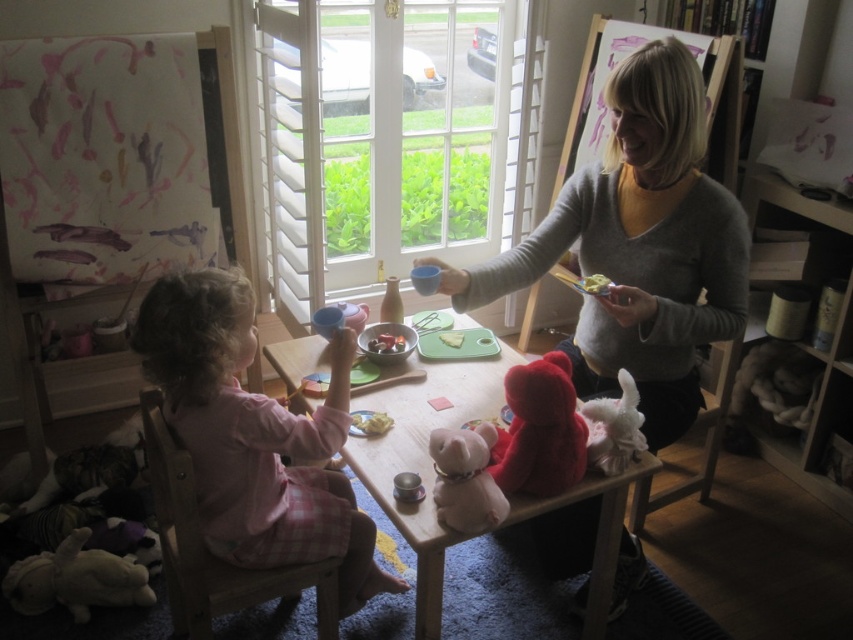
Question: Which of the following is the farthest from the observer?

Choices:
 (A) (599, 620)
 (B) (619, 376)
 (C) (374, 349)

Answer: (C)

Question: Is fluffy white stuffed animal at lower center to the left of smooth plastic spoon at center from the viewer's perspective?

Choices:
 (A) no
 (B) yes

Answer: (A)

Question: Is gray sweater at upper right positioned at the back of velvet plush bear at center?

Choices:
 (A) no
 (B) yes

Answer: (B)

Question: Which object is closer to the camera taking this photo?

Choices:
 (A) velvet plush bear at center
 (B) yellow creamy food at upper right
 (C) smooth plastic spoon at center
 (D) pink cotton dress at left

Answer: (D)

Question: Is wooden table at center positioned behind yellow creamy food at center?

Choices:
 (A) no
 (B) yes

Answer: (A)

Question: Estimate the real-world distances between objects in this image. Which object is closer to the fluffy white stuffed animal at lower left?

Choices:
 (A) yellow creamy food at center
 (B) wooden table at center
 (C) fluffy white stuffed animal at lower center

Answer: (B)